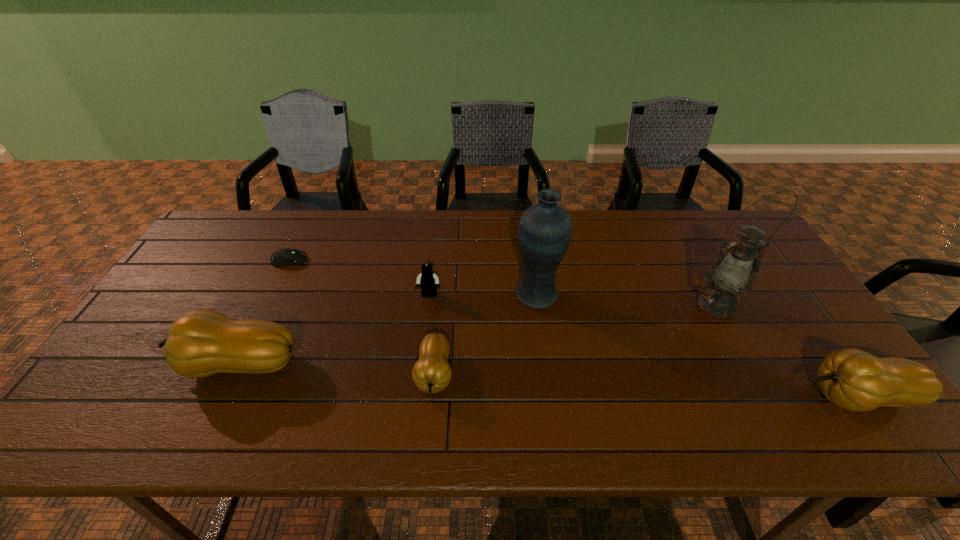
Select which object appears as the closest to the second gourd from right to left. Please provide its 2D coordinates. Your answer should be formatted as a tuple, i.e. [(x, y)], where the tuple contains the x and y coordinates of a point satisfying the conditions above.

[(429, 281)]

Select which object is the sixth closest to the sixth shortest object. Please provide its 2D coordinates. Your answer should be formatted as a tuple, i.e. [(x, y)], where the tuple contains the x and y coordinates of a point satisfying the conditions above.

[(283, 257)]

Where is `the closest gourd to the second tallest gourd`? Image resolution: width=960 pixels, height=540 pixels. the closest gourd to the second tallest gourd is located at coordinates (432, 373).

Select which gourd is the second closest to the second tallest gourd. Please provide its 2D coordinates. Your answer should be formatted as a tuple, i.e. [(x, y)], where the tuple contains the x and y coordinates of a point satisfying the conditions above.

[(205, 342)]

The image size is (960, 540). Find the location of `free space that satisfies the following two spatial constraints: 1. on the front-facing side of the Lego; 2. on the stem side of the leftmost gourd`. free space that satisfies the following two spatial constraints: 1. on the front-facing side of the Lego; 2. on the stem side of the leftmost gourd is located at coordinates (421, 364).

Identify the location of vacant area in the image that satisfies the following two spatial constraints: 1. on the front-facing side of the Lego; 2. on the stem side of the leftmost gourd. The image size is (960, 540). (421, 364).